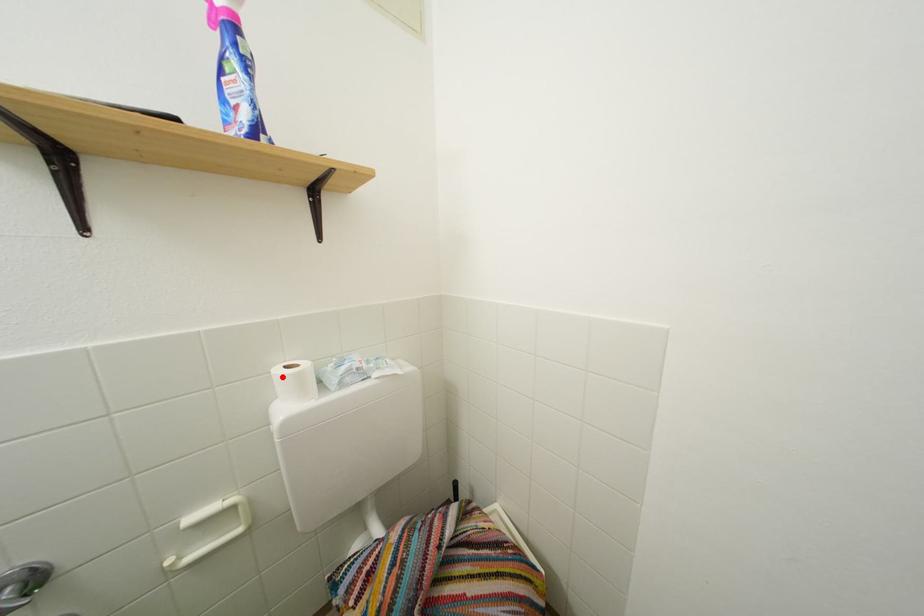
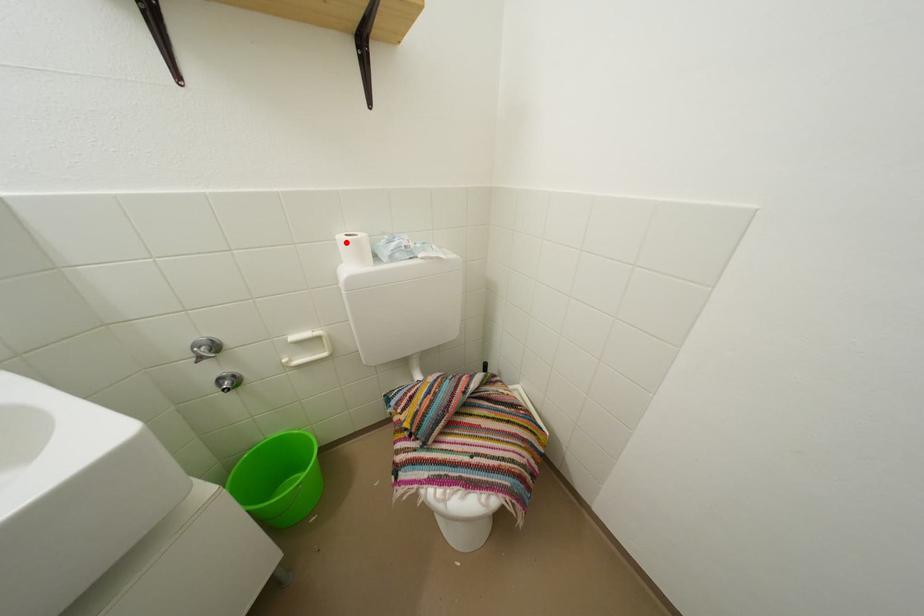
I am providing you with two images of the same scene from different viewpoints. A red point is marked on the first image and another point is marked on the second image. Is the marked point in image1 the same physical position as the marked point in image2?

Yes